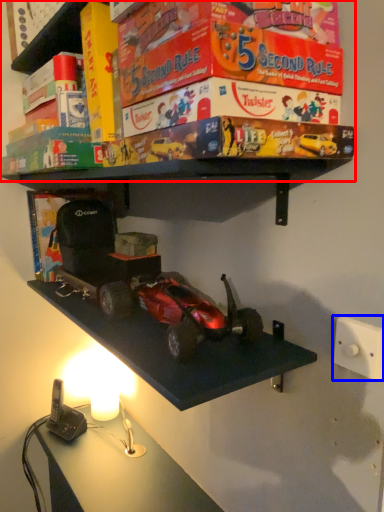
Question: Which of the following is the farthest to the observer, shelf (highlighted by a red box) or light switch (highlighted by a blue box)?

Choices:
 (A) shelf
 (B) light switch

Answer: (B)